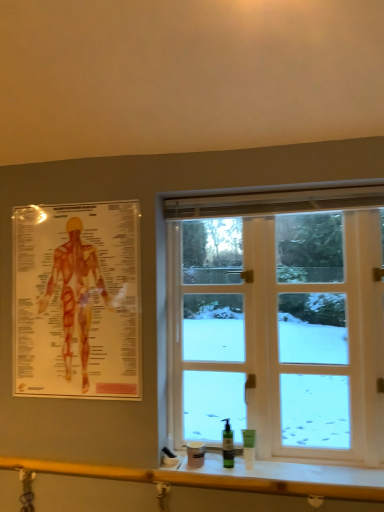
The height and width of the screenshot is (512, 384). I want to click on vacant area located to the right-hand side of green plastic bottle at lower right, which appears as the 1th toiletry when viewed from the right, so click(291, 464).